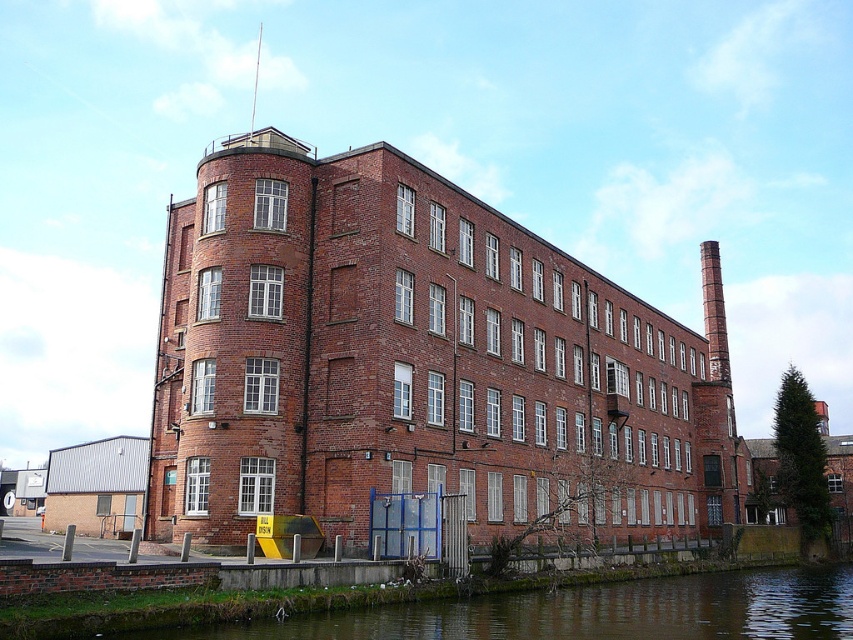
Question: Which point appears farthest from the camera in this image?

Choices:
 (A) (703, 289)
 (B) (432, 625)

Answer: (A)

Question: Which point is closer to the camera taking this photo?

Choices:
 (A) (715, 314)
 (B) (695, 579)

Answer: (B)

Question: Considering the relative positions of green mossy stone at lower left and red brick chimney at right in the image provided, where is green mossy stone at lower left located with respect to red brick chimney at right?

Choices:
 (A) right
 (B) left

Answer: (B)

Question: Is green mossy stone at lower left bigger than red brick chimney at right?

Choices:
 (A) yes
 (B) no

Answer: (B)

Question: From the image, what is the correct spatial relationship of green mossy stone at lower left in relation to red brick chimney at right?

Choices:
 (A) below
 (B) above

Answer: (A)